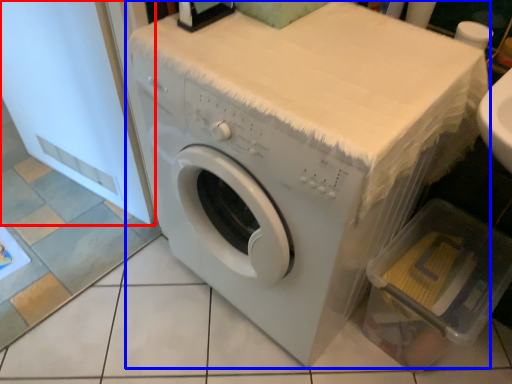
Question: Which object is closer to the camera taking this photo, screen door (highlighted by a red box) or washing machine (highlighted by a blue box)?

Choices:
 (A) screen door
 (B) washing machine

Answer: (B)